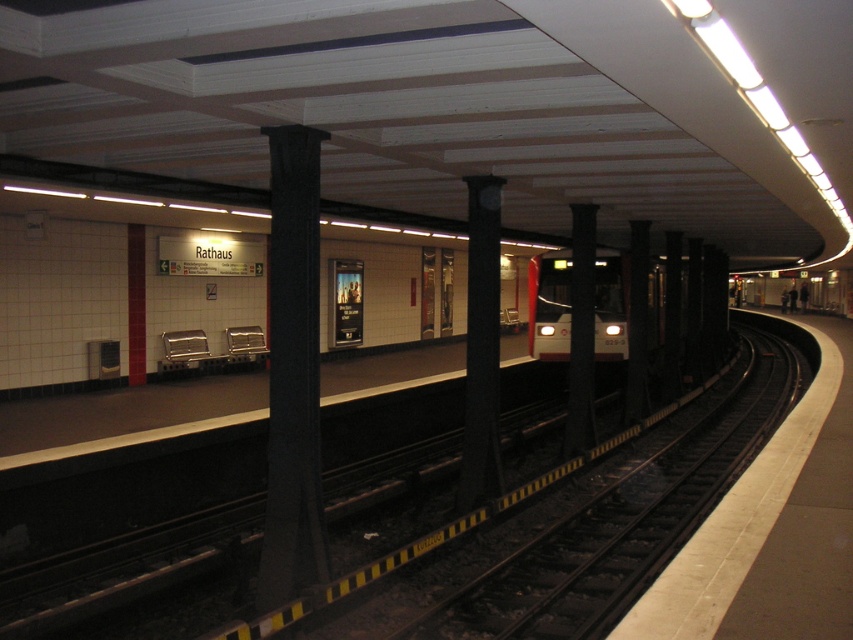
You are a maintenance worker on the subway platform. You need to check the size of the black metal track at center and the black polished pillar at center. Which one has a larger size according to the description?

The black metal track at center is bigger than the black polished pillar at center according to the description.

You are standing at the point labeled point (589, 520) on the subway platform. Which direction should you walk to reach the train visible on the right side of the image?

The point (589, 520) is on the black metal track at center, so to reach the train visible on the right side of the image, you should walk towards the right along the black metal track at center.